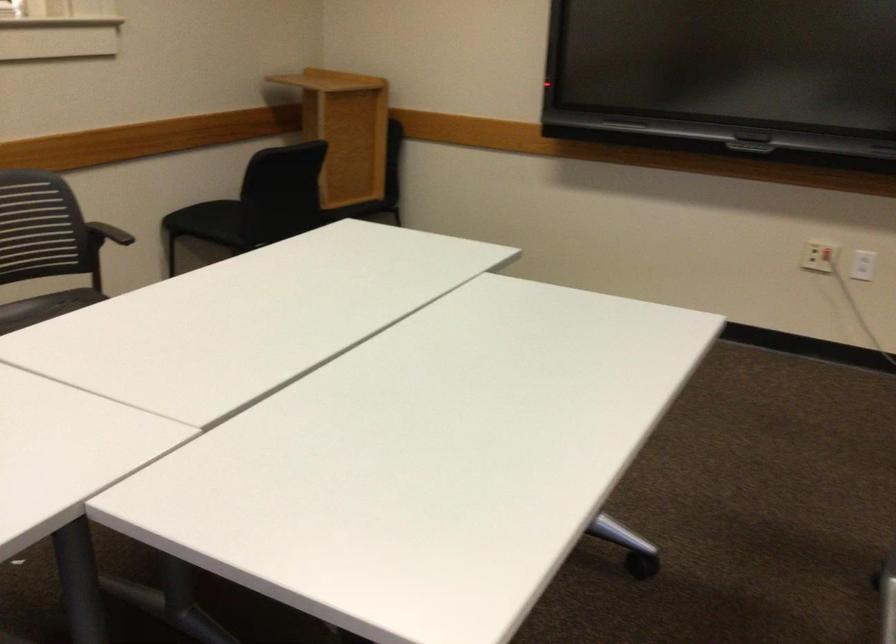
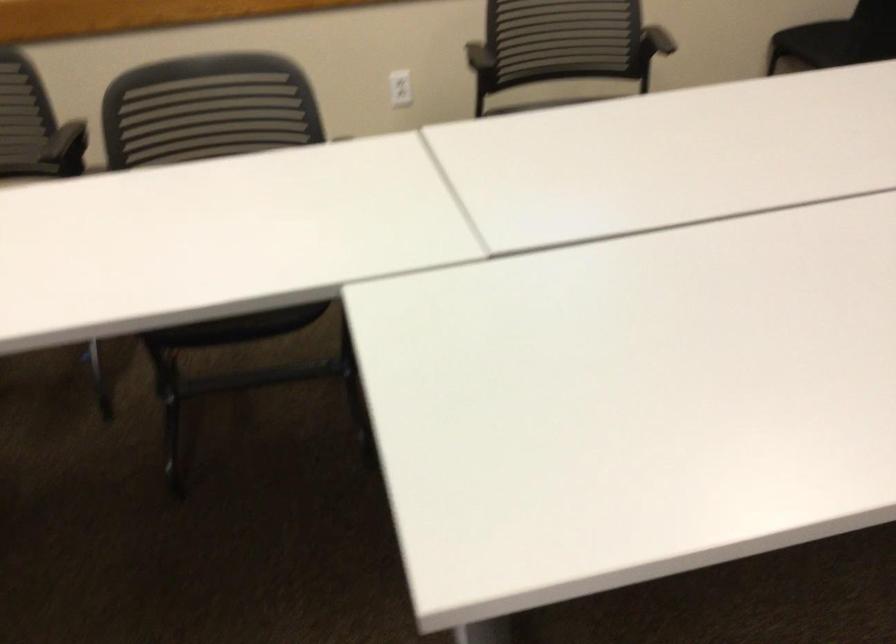
Consider the image. First-person continuous shooting, in which direction is the camera rotating?

The camera rotated toward left-down.